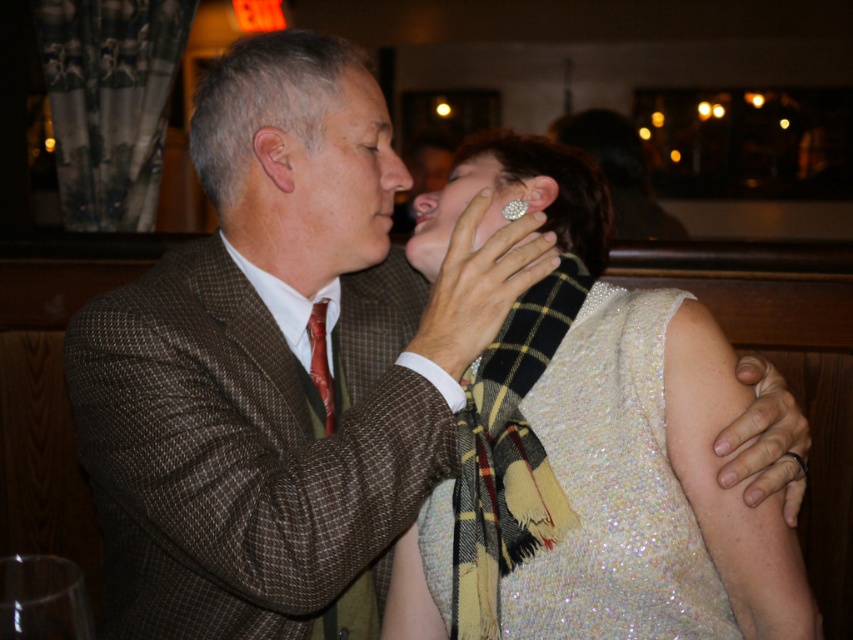
Is shiny silk tie at center shorter than black metal ring at upper right?

No, shiny silk tie at center is not shorter than black metal ring at upper right.

Which is above, shiny silk tie at center or black metal ring at upper right?

shiny silk tie at center

Describe the element at coordinates (321, 362) in the screenshot. I see `shiny silk tie at center` at that location.

Where is `shiny silk tie at center`? This screenshot has width=853, height=640. shiny silk tie at center is located at coordinates (321, 362).

Is sparkly white dress at center positioned in front of shiny silk tie at center?

Yes, it is.

Measure the distance between sparkly white dress at center and shiny silk tie at center.

They are 14.40 inches apart.

Who is more distant from viewer, (587,230) or (318,316)?

Positioned behind is point (587,230).

Identify the location of sparkly white dress at center. The width and height of the screenshot is (853, 640). (654, 477).

Can you confirm if sparkly white dress at center is positioned to the left of diamond shiny ring at ear?

Incorrect, sparkly white dress at center is not on the left side of diamond shiny ring at ear.

Who is positioned more to the left, sparkly white dress at center or diamond shiny ring at ear?

diamond shiny ring at ear

Locate an element on the screen. The width and height of the screenshot is (853, 640). sparkly white dress at center is located at coordinates (654, 477).